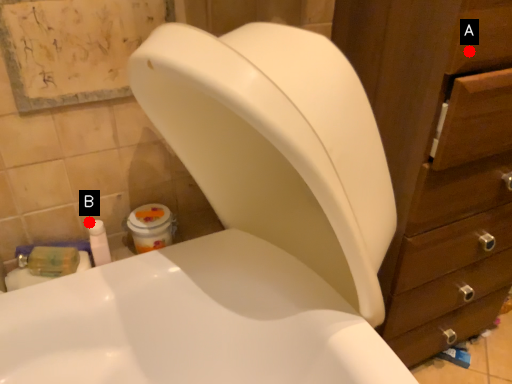
Question: Two points are circled on the image, labeled by A and B beside each circle. Which of the following is the farthest from the observer?

Choices:
 (A) A is further
 (B) B is further

Answer: (B)